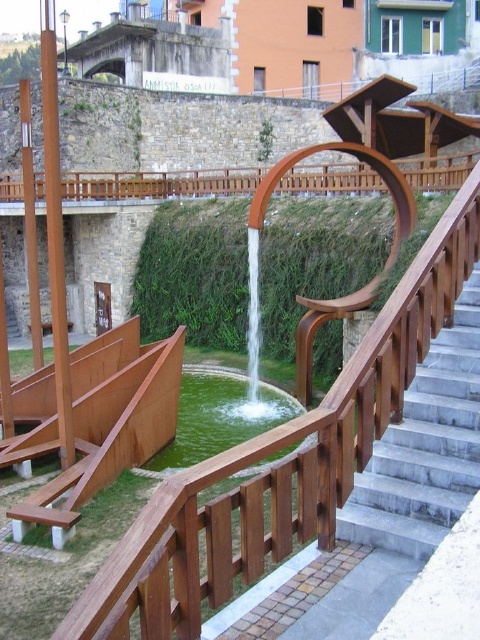
You are a delivery person carrying a large box that is 2 meters wide. You need to move from the green liquid water at center to the smooth gray concrete stairs at right. Can your box fit through the space between them?

The smooth gray concrete stairs at right is narrower than the green liquid water at center, so the 2 meter wide box may not fit through the space between them. Check the exact measurements before proceeding.